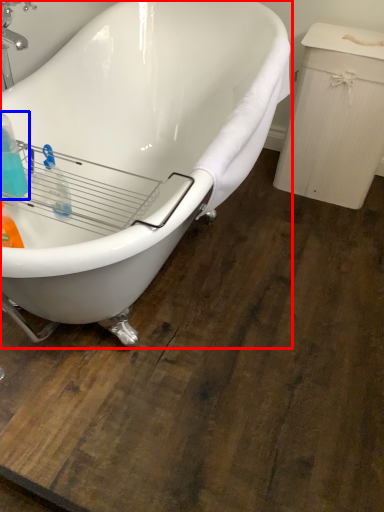
Question: Which object appears closest to the camera in this image, bathtub (highlighted by a red box) or cleaning product (highlighted by a blue box)?

Choices:
 (A) bathtub
 (B) cleaning product

Answer: (A)